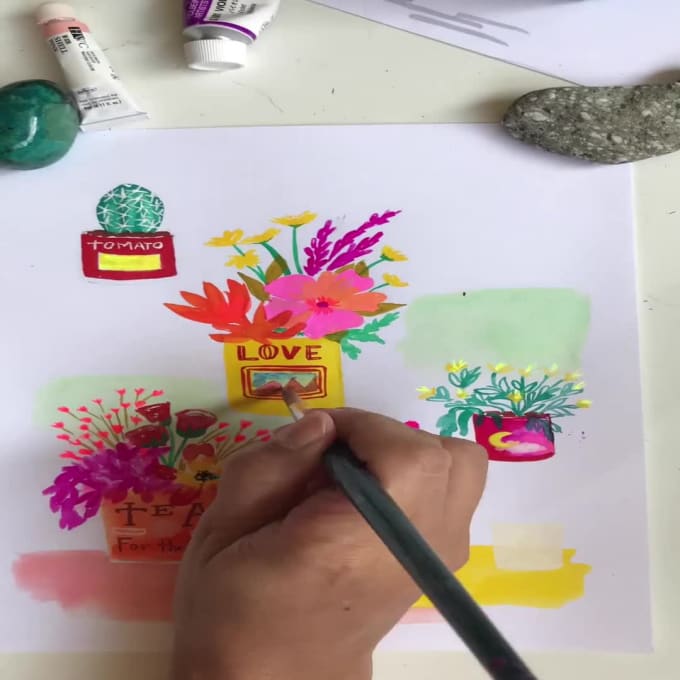
Locate an element on the screen. planter is located at coordinates coord(525,430), coord(173,526).